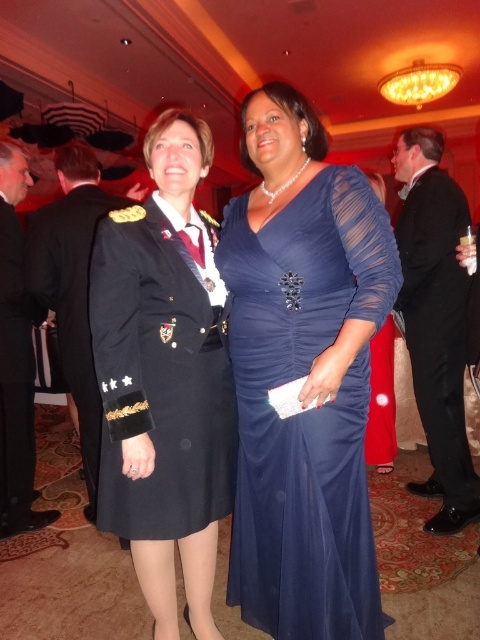
You are at a formal event and need to approach both the navy blue fabric uniform at left and the black satin suit at right. Which one should you approach first based on their positions?

You should approach the navy blue fabric uniform at left first because it is closer to you than the black satin suit at right.